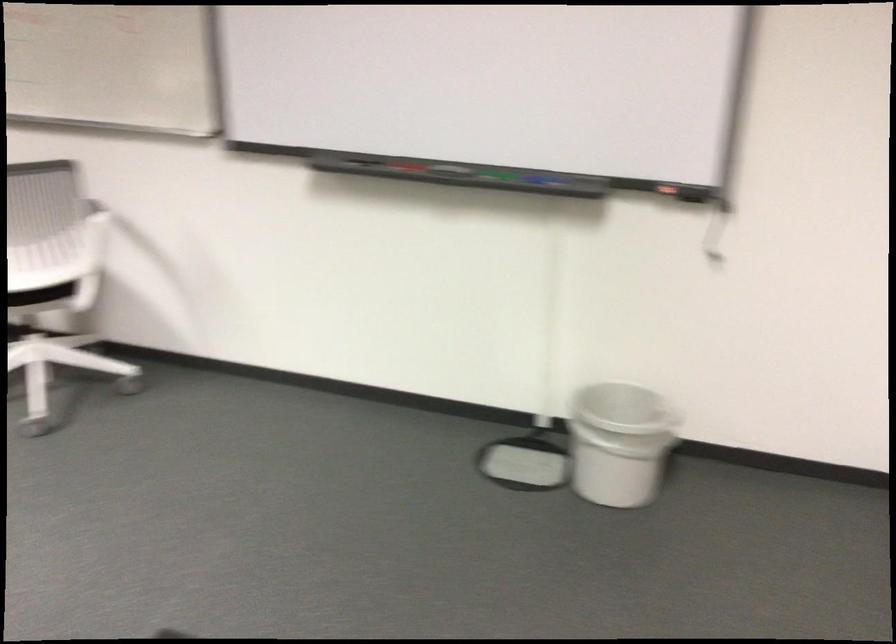
Find where to grasp the green whiteboard marker. Please return your answer as a coordinate pair (x, y).

(492, 176)